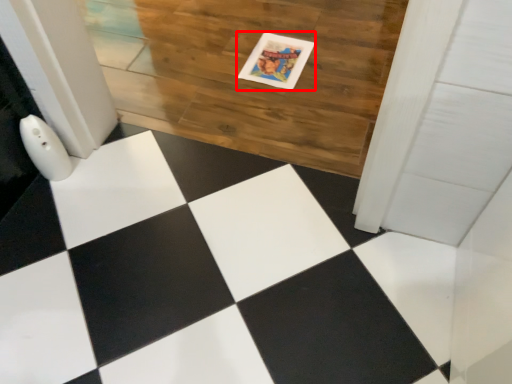
Question: In this image, where is postcard (annotated by the red box) located relative to hardwood?

Choices:
 (A) left
 (B) right

Answer: (B)